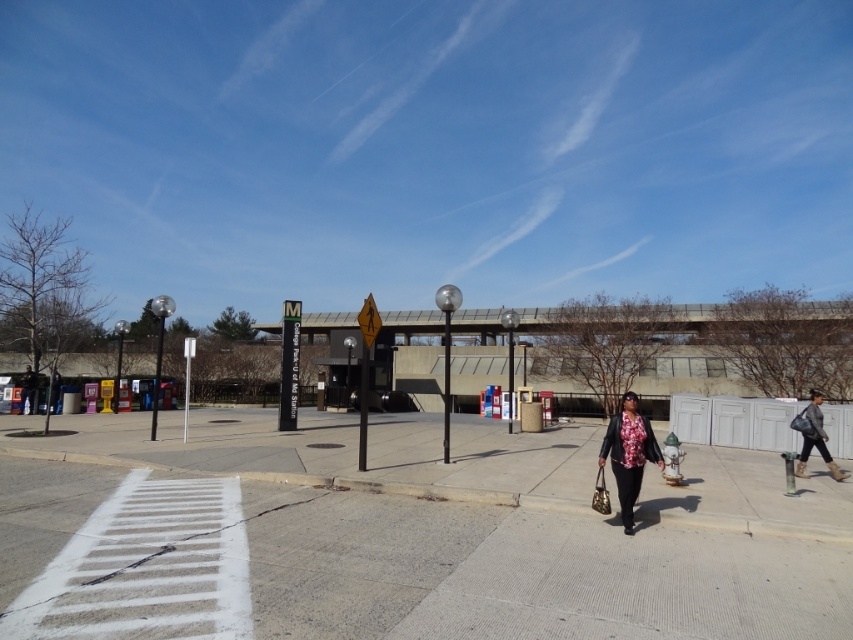
Is the position of white asphalt at lower left less distant than that of matte black jacket at center?

Yes, white asphalt at lower left is closer to the viewer.

Is point (664, 536) positioned in front of point (640, 477)?

No.

Is point (0, 520) positioned behind point (630, 506)?

No, it is not.

What are the coordinates of `white asphalt at lower left` in the screenshot? It's located at (521, 573).

Is point (532, 557) in front of point (822, 445)?

That is True.

Is white asphalt at lower left bigger than leather jacket at lower right?

Correct, white asphalt at lower left is larger in size than leather jacket at lower right.

I want to click on white asphalt at lower left, so click(521, 573).

In the scene shown: Who is more distant from viewer, (639, 461) or (819, 420)?

The point (819, 420) is behind.

This screenshot has width=853, height=640. Identify the location of matte black jacket at center. (628, 452).

Find the location of a particular element. The image size is (853, 640). matte black jacket at center is located at coordinates (628, 452).